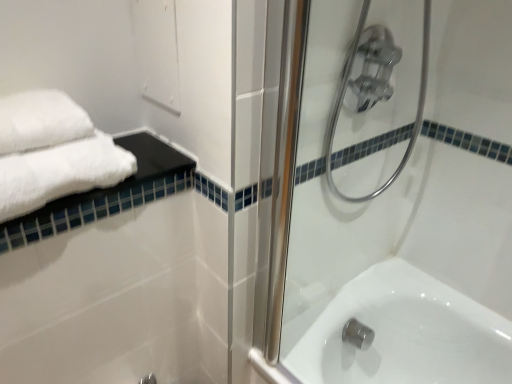
Question: Is clear glass shower door at upper center shorter than white soft towel at upper left?

Choices:
 (A) yes
 (B) no

Answer: (B)

Question: Can you confirm if clear glass shower door at upper center is positioned to the right of white soft towel at upper left?

Choices:
 (A) yes
 (B) no

Answer: (A)

Question: Is clear glass shower door at upper center wider than white soft towel at upper left?

Choices:
 (A) yes
 (B) no

Answer: (B)

Question: Does clear glass shower door at upper center have a lesser width compared to white soft towel at upper left?

Choices:
 (A) yes
 (B) no

Answer: (A)

Question: From the image's perspective, does clear glass shower door at upper center appear higher than white soft towel at upper left?

Choices:
 (A) no
 (B) yes

Answer: (A)

Question: Is clear glass shower door at upper center bigger than white soft towel at upper left?

Choices:
 (A) yes
 (B) no

Answer: (A)

Question: Does white soft towel at upper left turn towards clear glass shower door at upper center?

Choices:
 (A) no
 (B) yes

Answer: (A)

Question: Is white soft towel at upper left taller than clear glass shower door at upper center?

Choices:
 (A) yes
 (B) no

Answer: (B)

Question: Is white soft towel at upper left wider than clear glass shower door at upper center?

Choices:
 (A) yes
 (B) no

Answer: (A)

Question: Is white soft towel at upper left turned away from clear glass shower door at upper center?

Choices:
 (A) yes
 (B) no

Answer: (B)

Question: Considering the relative sizes of white soft towel at upper left and clear glass shower door at upper center in the image provided, is white soft towel at upper left thinner than clear glass shower door at upper center?

Choices:
 (A) yes
 (B) no

Answer: (B)

Question: Is white soft towel at upper left far from clear glass shower door at upper center?

Choices:
 (A) no
 (B) yes

Answer: (A)

Question: Would you say white soft towel at upper left is inside or outside clear glass shower door at upper center?

Choices:
 (A) outside
 (B) inside

Answer: (A)